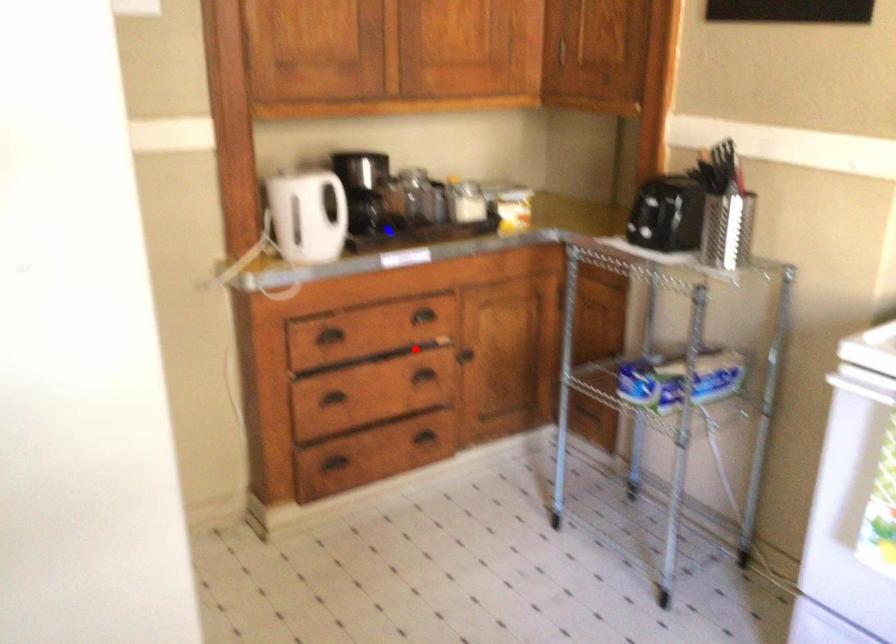
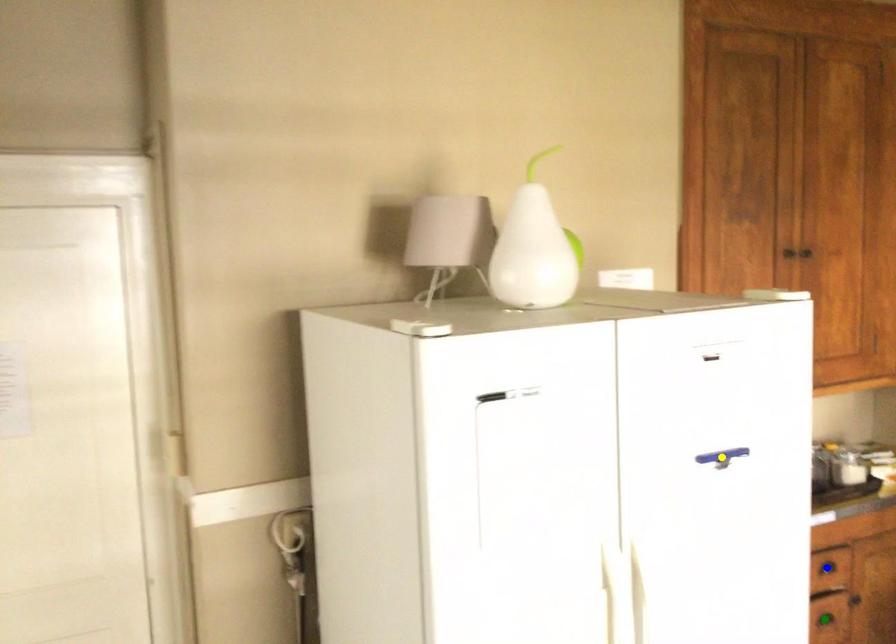
Question: I am providing you with two images of the same scene from different viewpoints. A red point is marked on the first image. You are given multiple points on the second image. Which point in image 2 represents the same 3d spot as the red point in image 1?

Choices:
 (A) yellow point
 (B) blue point
 (C) green point

Answer: (C)